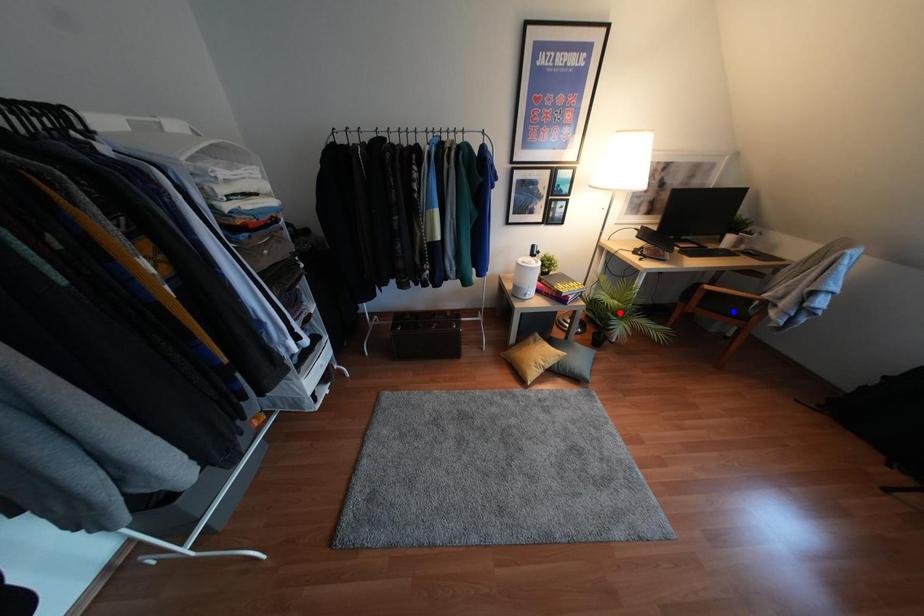
Question: Two points are marked on the image. Which point is closer to the camera?

Choices:
 (A) Blue point is closer.
 (B) Red point is closer.

Answer: (A)